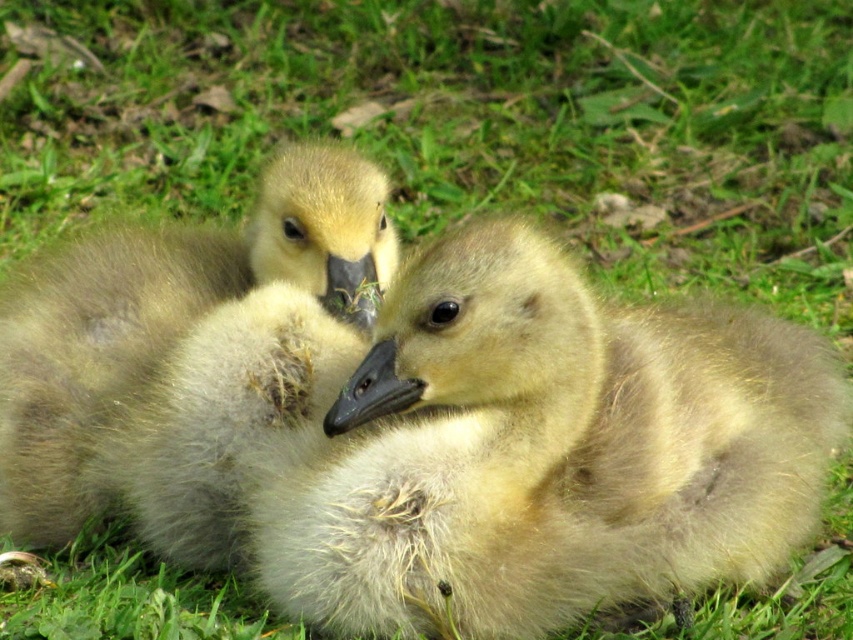
Question: Which point is farther from the camera taking this photo?

Choices:
 (A) (372, 333)
 (B) (39, 406)

Answer: (B)

Question: Can you confirm if soft yellow down at center is positioned to the right of soft brown downy goose at left?

Choices:
 (A) no
 (B) yes

Answer: (B)

Question: Is soft yellow down at center bigger than soft brown downy goose at left?

Choices:
 (A) no
 (B) yes

Answer: (B)

Question: Among these points, which one is nearest to the camera?

Choices:
 (A) (706, 429)
 (B) (227, 330)

Answer: (A)

Question: Is soft yellow down at center above soft brown downy goose at left?

Choices:
 (A) no
 (B) yes

Answer: (A)

Question: Among these points, which one is nearest to the camera?

Choices:
 (A) click(x=196, y=308)
 (B) click(x=730, y=410)

Answer: (B)